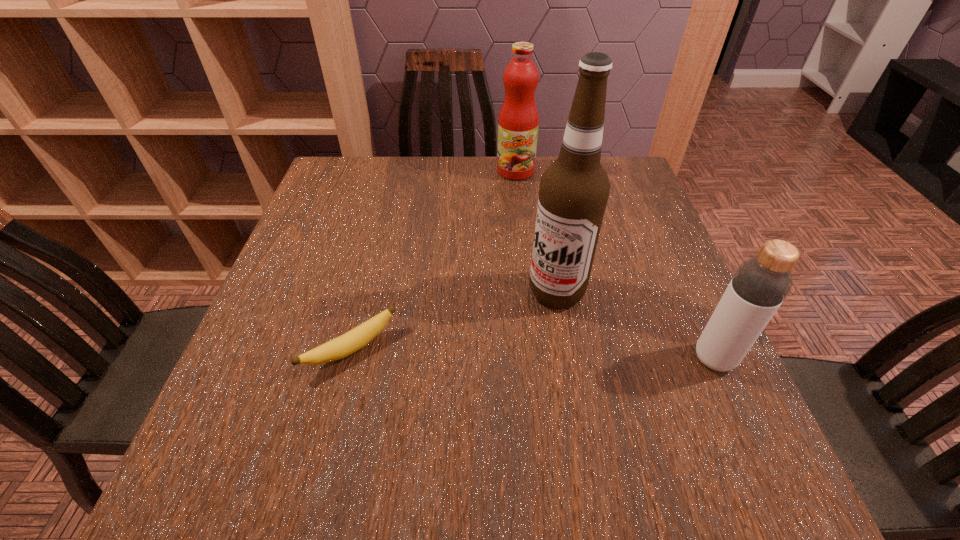
At what (x,y) coordinates should I click in order to perform the action: click on vacant space located on the label of the tallest object. Please return your answer as a coordinate pair (x, y). The width and height of the screenshot is (960, 540). Looking at the image, I should click on (484, 358).

The height and width of the screenshot is (540, 960). I want to click on vacant space located 0.200m on the label of the tallest object, so click(472, 368).

This screenshot has width=960, height=540. What are the coordinates of `free space located on the label of the tallest object` in the screenshot? It's located at (428, 408).

This screenshot has height=540, width=960. What are the coordinates of `vacant space located on the front label of the fruit juice` in the screenshot? It's located at (514, 220).

The height and width of the screenshot is (540, 960). I want to click on blank space located on the front label of the fruit juice, so click(x=514, y=228).

Identify the location of vacant space situated 0.380m on the front label of the fruit juice. Image resolution: width=960 pixels, height=540 pixels. (513, 275).

Locate an element on the screen. object at the far edge is located at coordinates (518, 122).

Identify the location of object that is at the left edge. The width and height of the screenshot is (960, 540). (352, 341).

Where is `object at the right edge`? object at the right edge is located at coordinates (759, 286).

You are a GUI agent. You are given a task and a screenshot of the screen. Output one action in this format:
    pyautogui.click(x=<x>, y=<y>)
    Task: Click on the blank space at the far edge of the desktop
    
    Given the screenshot: What is the action you would take?
    pyautogui.click(x=459, y=180)